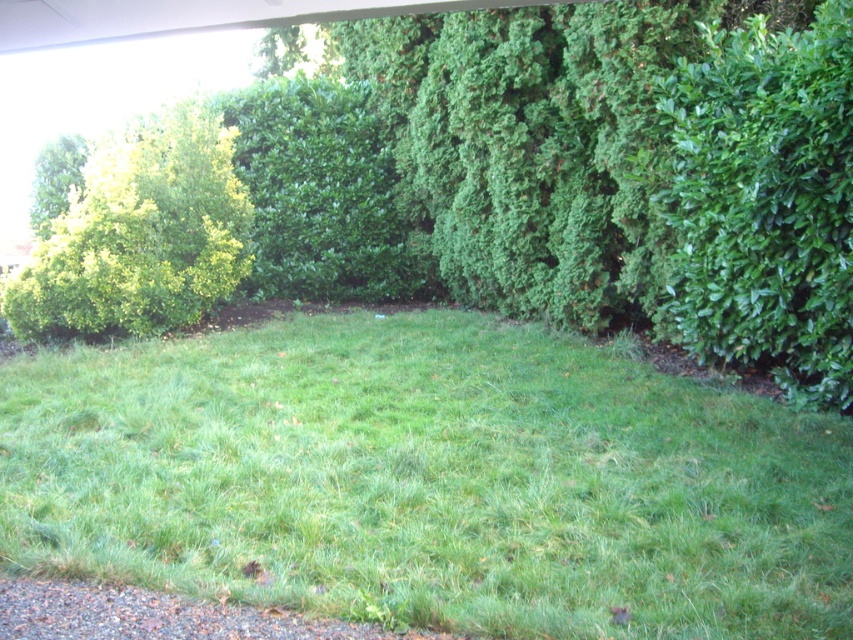
Question: Estimate the real-world distances between objects in this image. Which object is farther from the green leafy bush at upper right?

Choices:
 (A) green leafy bush at left
 (B) green leafy tree at upper left
 (C) green grassy area at center
 (D) green leafy bush at center

Answer: (B)

Question: Does green leafy bush at left have a greater width compared to green leafy bush at center?

Choices:
 (A) no
 (B) yes

Answer: (A)

Question: Which object is the closest to the green leafy bush at left?

Choices:
 (A) green leafy bush at center
 (B) green grassy area at center
 (C) green leafy bush at upper right

Answer: (A)

Question: Among these points, which one is nearest to the camera?

Choices:
 (A) (53, 145)
 (B) (19, 330)
 (C) (338, 236)

Answer: (B)

Question: Does green leafy bush at center appear on the right side of green leafy tree at upper left?

Choices:
 (A) no
 (B) yes

Answer: (B)

Question: Does green leafy bush at upper right have a greater width compared to green leafy bush at center?

Choices:
 (A) no
 (B) yes

Answer: (A)